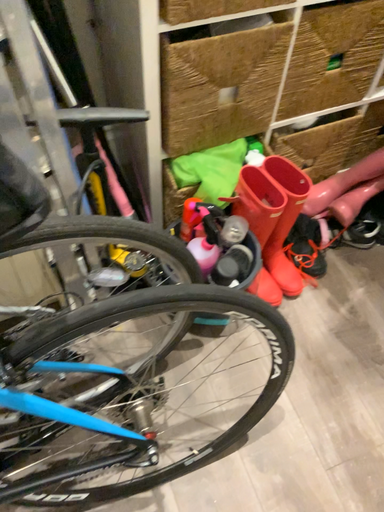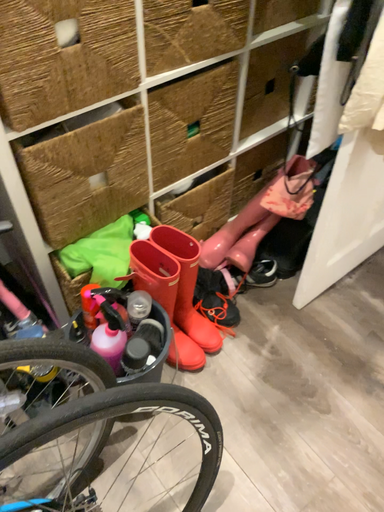
Question: Which way did the camera rotate in the video?

Choices:
 (A) rotated downward
 (B) rotated upward

Answer: (B)